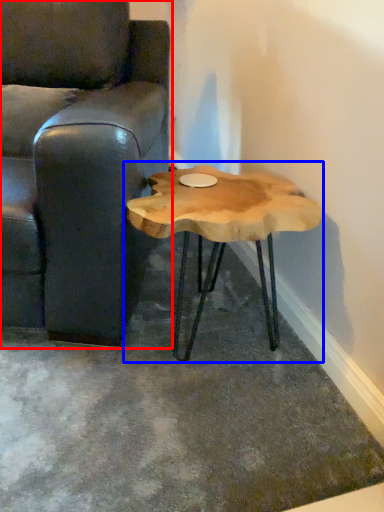
Question: Which of the following is the farthest to the observer, chair (highlighted by a red box) or coffee table (highlighted by a blue box)?

Choices:
 (A) chair
 (B) coffee table

Answer: (B)